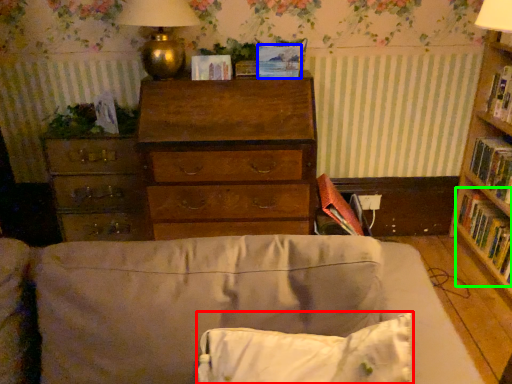
Question: Which object is positioned closest to pillow (highlighted by a red box)? Select from paperback book (highlighted by a blue box) and book (highlighted by a green box).

Choices:
 (A) paperback book
 (B) book

Answer: (A)